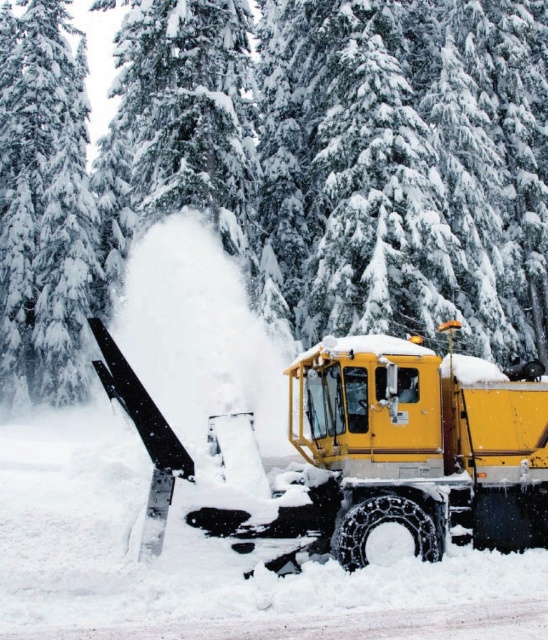
Can you confirm if snow-covered pine tree at center is positioned above white snow-covered tree at left?

No.

Between snow-covered pine tree at center and white snow-covered tree at left, which one is positioned lower?

snow-covered pine tree at center is below.

This screenshot has height=640, width=548. In order to click on snow-covered pine tree at center in this screenshot , I will do `click(289, 163)`.

Who is lower down, yellow matte/snow-covered snowplow at center or white snow-covered tree at left?

yellow matte/snow-covered snowplow at center is lower down.

In the scene shown: Is yellow matte/snow-covered snowplow at center to the left of white snow-covered tree at left from the viewer's perspective?

In fact, yellow matte/snow-covered snowplow at center is to the right of white snow-covered tree at left.

The width and height of the screenshot is (548, 640). What are the coordinates of `yellow matte/snow-covered snowplow at center` in the screenshot? It's located at (407, 456).

Find the location of a particular element. The image size is (548, 640). yellow matte/snow-covered snowplow at center is located at coordinates (407, 456).

Is point (15, 72) behind point (404, 520)?

Yes, point (15, 72) is behind point (404, 520).

Consider the image. Does snow-covered pine tree at center lie in front of yellow matte/snow-covered snowplow at center?

No, snow-covered pine tree at center is behind yellow matte/snow-covered snowplow at center.

You are a GUI agent. You are given a task and a screenshot of the screen. Output one action in this format:
    pyautogui.click(x=<x>, y=<y>)
    Task: Click on the snow-covered pine tree at center
    This screenshot has width=548, height=640.
    Given the screenshot: What is the action you would take?
    pyautogui.click(x=289, y=163)